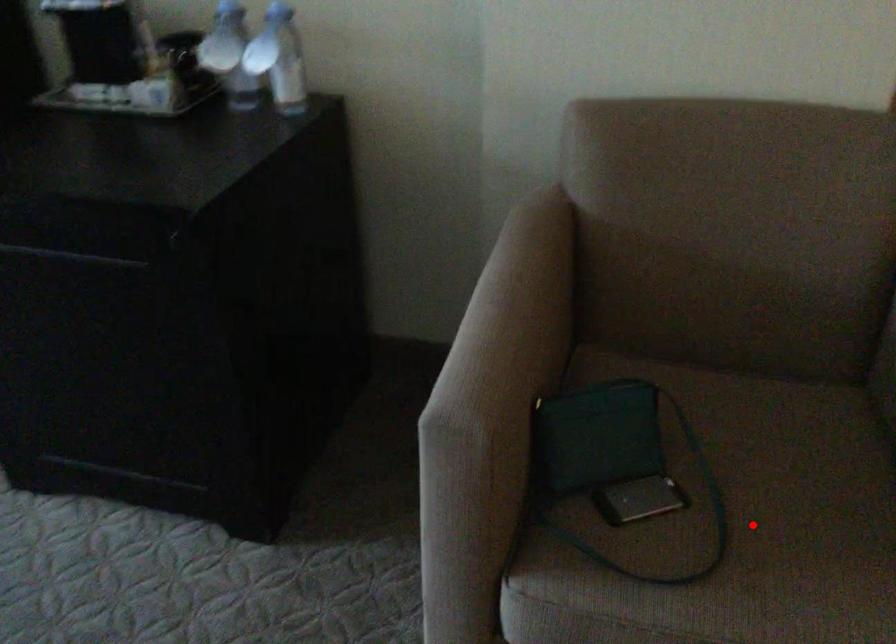
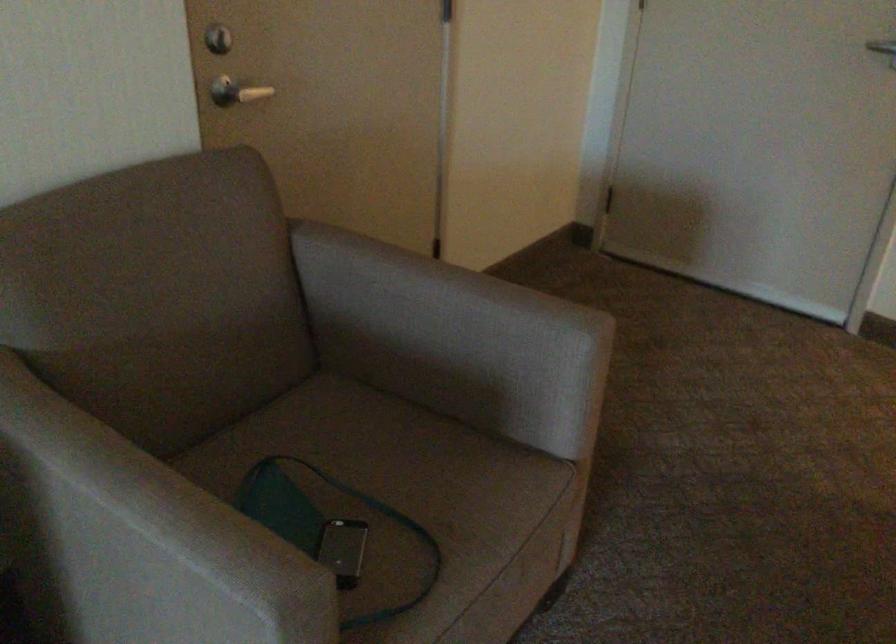
Question: I am providing you with two images of the same scene from different viewpoints. Given a red point in image1, look at the same physical point in image2. Is it:

Choices:
 (A) Closer to the viewpoint
 (B) Farther from the viewpoint

Answer: (B)